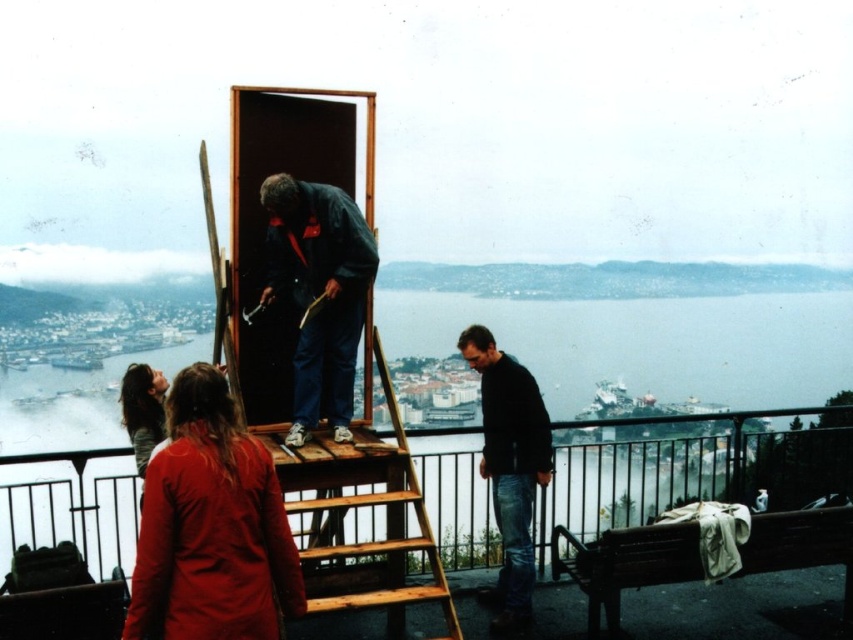
Does wooden at center have a smaller size compared to black sweater at center?

Actually, wooden at center might be larger than black sweater at center.

Does wooden at center have a larger size compared to black sweater at center?

Correct, wooden at center is larger in size than black sweater at center.

Where is `wooden at center`? wooden at center is located at coordinates (357, 516).

Is point (426, 600) closer to viewer compared to point (318, 225)?

That is True.

Can you confirm if wooden at center is positioned to the right of dark blue fabric jacket at center?

Indeed, wooden at center is positioned on the right side of dark blue fabric jacket at center.

Is point (340, 449) behind point (352, 332)?

No, (340, 449) is closer to viewer.

The height and width of the screenshot is (640, 853). What are the coordinates of `wooden at center` in the screenshot? It's located at (357, 516).

Who is more forward, (318,600) or (135,365)?

Positioned in front is point (318,600).

Measure the distance between wooden at center and camera.

The distance of wooden at center from camera is 108.68 meters.

The width and height of the screenshot is (853, 640). I want to click on wooden at center, so click(357, 516).